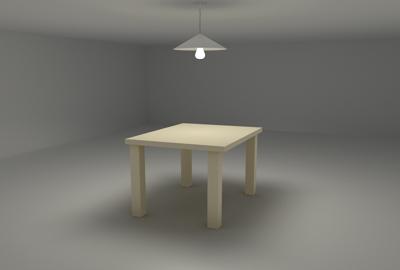
Image resolution: width=400 pixels, height=270 pixels. Find the location of `ceiling light`. ceiling light is located at coordinates (200, 36).